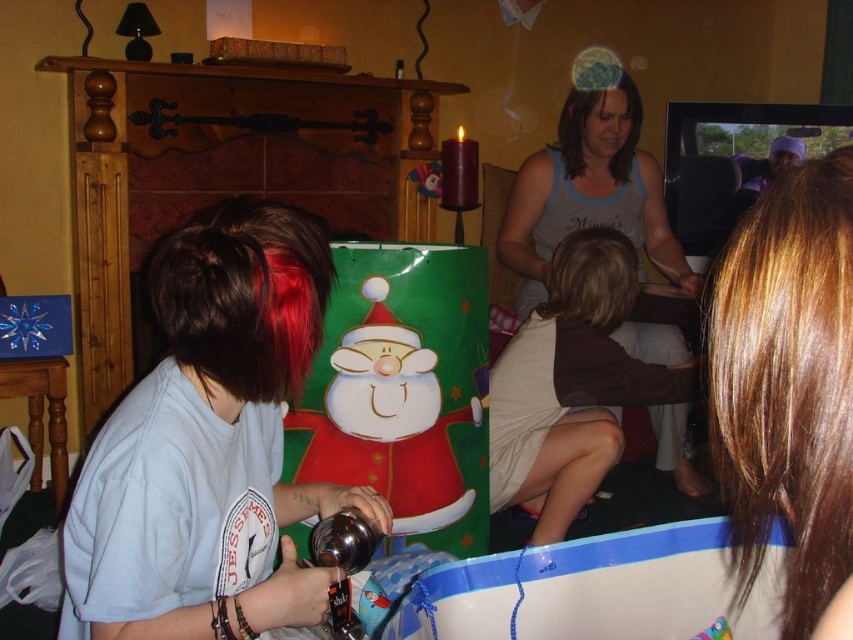
Question: Can you confirm if light blue cotton shirt at left is positioned above cartoon santa claus wrapping paper at center?

Choices:
 (A) yes
 (B) no

Answer: (A)

Question: Does shiny brown hair at right have a smaller size compared to gray tank top at center?

Choices:
 (A) yes
 (B) no

Answer: (A)

Question: Is light blue cotton shirt at left further to the viewer compared to gray tank top at center?

Choices:
 (A) no
 (B) yes

Answer: (A)

Question: Which object is farther from the camera taking this photo?

Choices:
 (A) cartoon santa claus wrapping paper at center
 (B) shiny brown hair at right

Answer: (A)

Question: Which object is closer to the camera taking this photo?

Choices:
 (A) gray tank top at center
 (B) light blue cotton shirt at left
 (C) cartoon santa claus wrapping paper at center

Answer: (B)

Question: Which point appears closest to the camera in this image?

Choices:
 (A) (201, 620)
 (B) (848, 515)

Answer: (B)